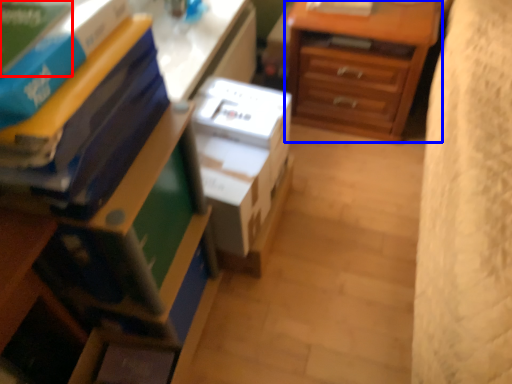
Question: Which object is closer to the camera taking this photo, paperback book (highlighted by a red box) or chest of drawers (highlighted by a blue box)?

Choices:
 (A) paperback book
 (B) chest of drawers

Answer: (A)